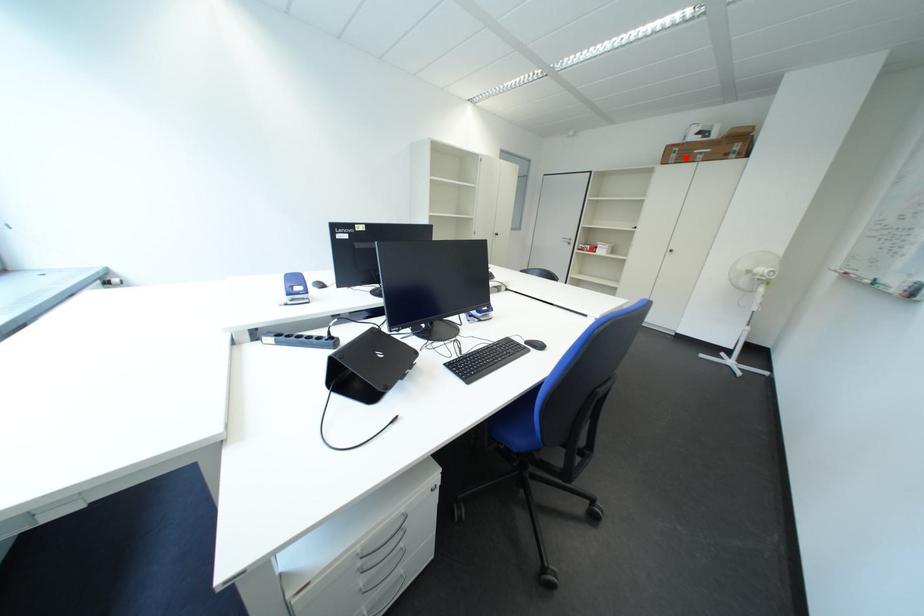
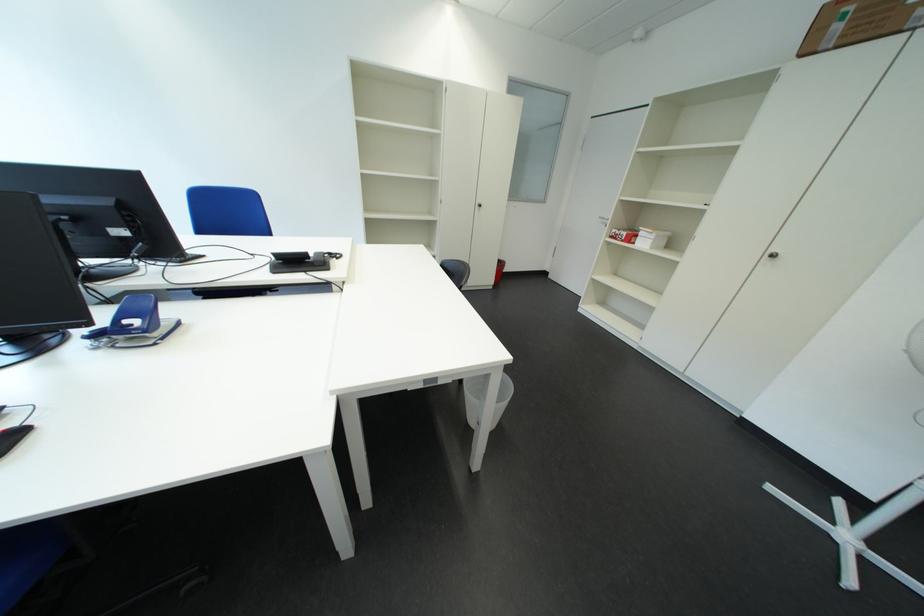
Question: I am providing you with two images of the same scene from different viewpoints. Image1 has a red point marked. In image2, the corresponding 3D location appears at what relative position? Reply with the corresponding letter.

Choices:
 (A) Closer
 (B) Farther

Answer: (B)